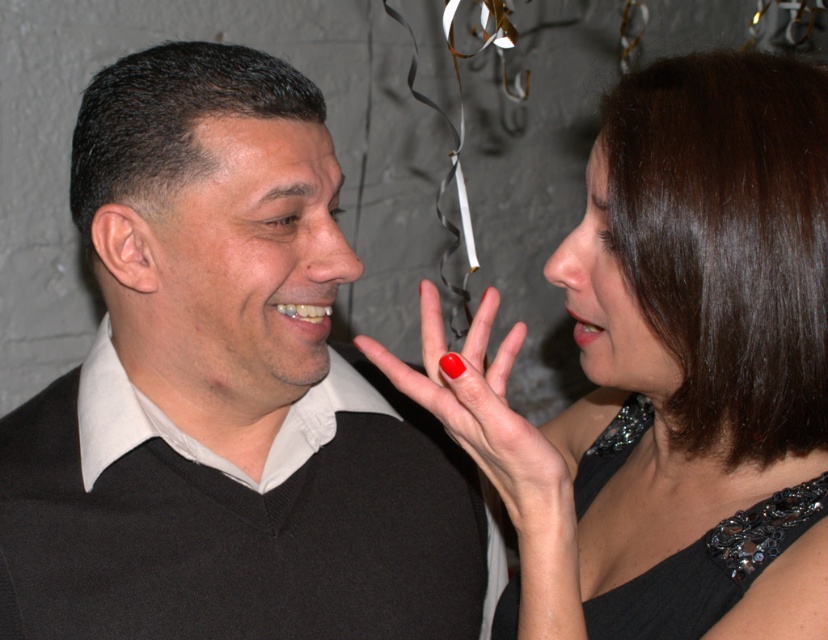
In the scene shown: Is the position of shiny black dress at right less distant than that of shiny red nail at center?

Yes, shiny black dress at right is closer to the viewer.

The height and width of the screenshot is (640, 828). What do you see at coordinates (670, 371) in the screenshot? I see `shiny black dress at right` at bounding box center [670, 371].

The image size is (828, 640). In order to click on shiny black dress at right in this screenshot , I will do pyautogui.click(x=670, y=371).

Is black matte sweater at left to the left of shiny red nail at center from the viewer's perspective?

Yes, black matte sweater at left is to the left of shiny red nail at center.

Is point (282, 296) closer to camera compared to point (393, 384)?

No, it is not.

Locate an element on the screen. The image size is (828, 640). black matte sweater at left is located at coordinates (224, 392).

Who is higher up, black matte sweater at left or black sequined dress at center?

black matte sweater at left is above.

Identify the location of black matte sweater at left. This screenshot has height=640, width=828. (224, 392).